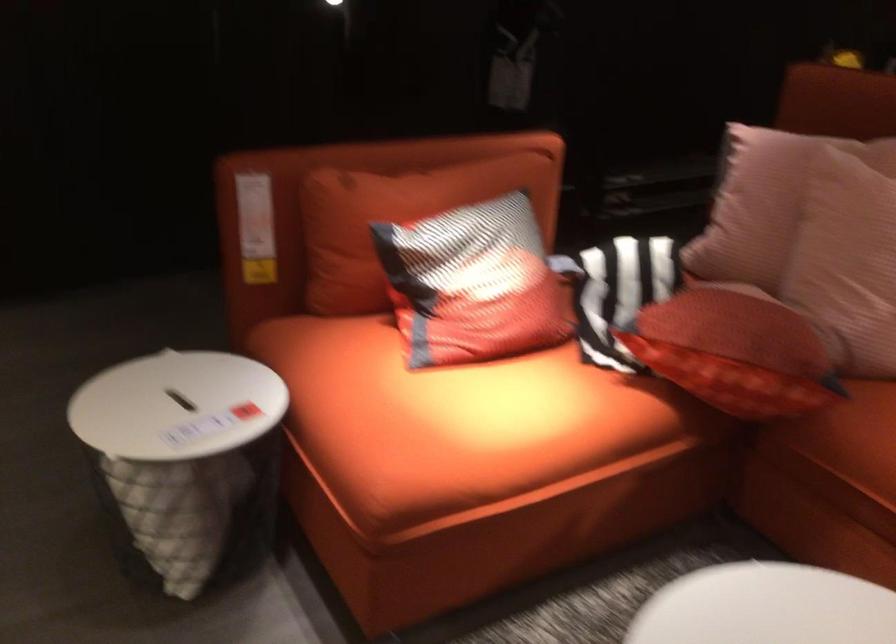
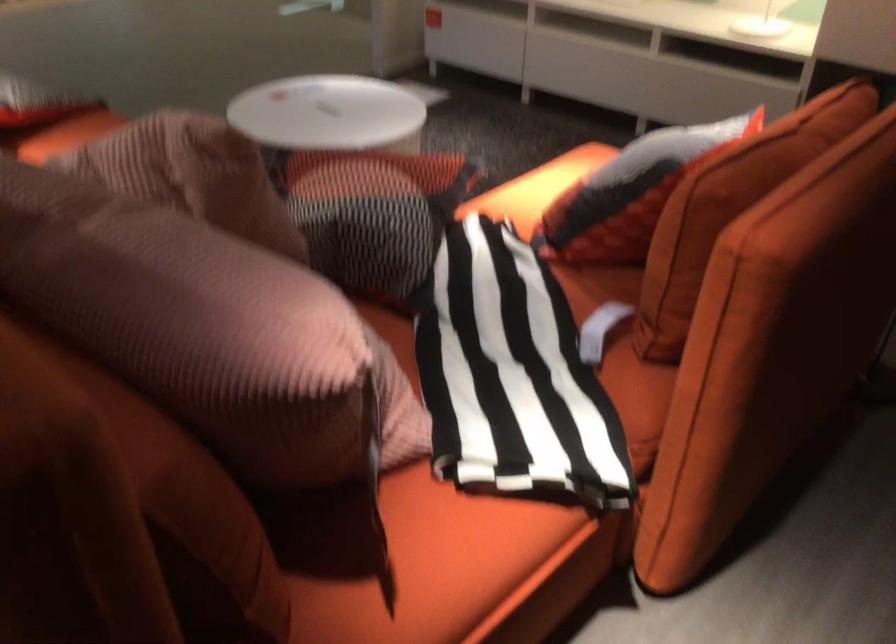
In the second image, find the point that corresponds to [794,136] in the first image.

(205, 328)